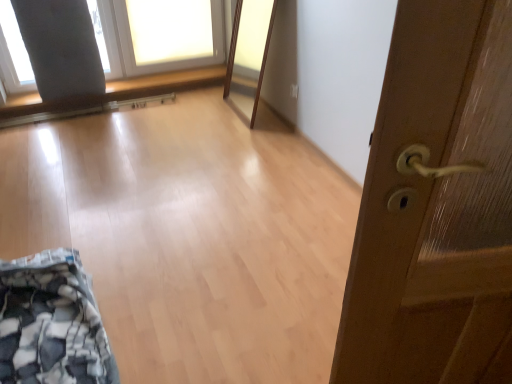
The width and height of the screenshot is (512, 384). Describe the element at coordinates (436, 207) in the screenshot. I see `wooden door handle at right` at that location.

Identify the location of wooden door handle at right. (436, 207).

Locate an element on the screen. white fabric at upper left is located at coordinates (15, 43).

Describe the element at coordinates (15, 43) in the screenshot. The image size is (512, 384). I see `white fabric at upper left` at that location.

Locate an element on the screen. This screenshot has height=384, width=512. wooden door handle at right is located at coordinates (436, 207).

Considering the relative positions of wooden door handle at right and white fabric at upper left in the image provided, is wooden door handle at right to the left of white fabric at upper left from the viewer's perspective?

Incorrect, wooden door handle at right is not on the left side of white fabric at upper left.

Considering the relative positions of wooden door handle at right and white fabric at upper left in the image provided, is wooden door handle at right behind white fabric at upper left?

No, wooden door handle at right is closer to the camera.

Is point (339, 374) closer or farther from the camera than point (96, 40)?

Point (339, 374) is closer to the camera than point (96, 40).

From the image's perspective, is wooden door handle at right beneath white fabric at upper left?

Yes.

From a real-world perspective, which is physically below, wooden door handle at right or white fabric at upper left?

white fabric at upper left.

Which of these two, wooden door handle at right or white fabric at upper left, is wider?

white fabric at upper left is wider.

Considering the sizes of objects wooden door handle at right and white fabric at upper left in the image provided, who is shorter, wooden door handle at right or white fabric at upper left?

With less height is white fabric at upper left.

Is wooden door handle at right smaller than white fabric at upper left?

Correct, wooden door handle at right occupies less space than white fabric at upper left.

Is wooden door handle at right not within white fabric at upper left?

Yes, wooden door handle at right is outside of white fabric at upper left.

Is wooden door handle at right far away from white fabric at upper left?

Yes, wooden door handle at right and white fabric at upper left are located far from each other.

Looking at this image, is wooden door handle at right aimed at white fabric at upper left?

No.

How different are the orientations of wooden door handle at right and white fabric at upper left in degrees?

The facing directions of wooden door handle at right and white fabric at upper left are 166 degrees apart.

You are a GUI agent. You are given a task and a screenshot of the screen. Output one action in this format:
    pyautogui.click(x=<x>, y=<y>)
    Task: Click on the window screen on the left of wooden door handle at right
    Image resolution: width=512 pixels, height=384 pixels.
    Given the screenshot: What is the action you would take?
    pyautogui.click(x=15, y=43)

Does white fabric at upper left appear on the left side of wooden door handle at right?

Yes.

Relative to wooden door handle at right, is white fabric at upper left in front or behind?

white fabric at upper left is behind wooden door handle at right.

Which is less distant, (15, 53) or (367, 240)?

Point (15, 53) is farther from the camera than point (367, 240).

Consider the image. From the image's perspective, relative to wooden door handle at right, is white fabric at upper left above or below?

From the image's perspective, white fabric at upper left appears above wooden door handle at right.

From a real-world perspective, which object stands above the other?

wooden door handle at right is physically above.

Between white fabric at upper left and wooden door handle at right, which one has smaller width?

wooden door handle at right.

In the scene shown: Considering the sizes of objects white fabric at upper left and wooden door handle at right in the image provided, who is taller, white fabric at upper left or wooden door handle at right?

Standing taller between the two is wooden door handle at right.

Does white fabric at upper left have a smaller size compared to wooden door handle at right?

No.

Can we say white fabric at upper left lies outside wooden door handle at right?

white fabric at upper left lies outside wooden door handle at right's area.

Is white fabric at upper left touching wooden door handle at right?

They are not placed beside each other.

Is white fabric at upper left aimed at wooden door handle at right?

Yes, white fabric at upper left is aimed at wooden door handle at right.

I want to click on window screen on the left of wooden door handle at right, so 15,43.

This screenshot has width=512, height=384. Identify the location of window screen behind the wooden door handle at right. (15, 43).

The height and width of the screenshot is (384, 512). Find the location of `door below the white fabric at upper left (from the image's perspective)`. door below the white fabric at upper left (from the image's perspective) is located at coordinates (436, 207).